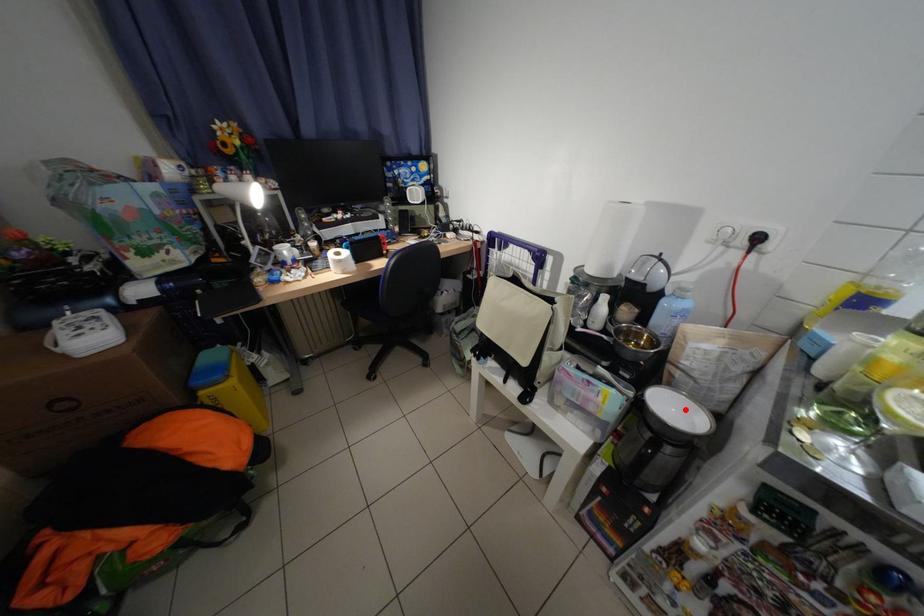
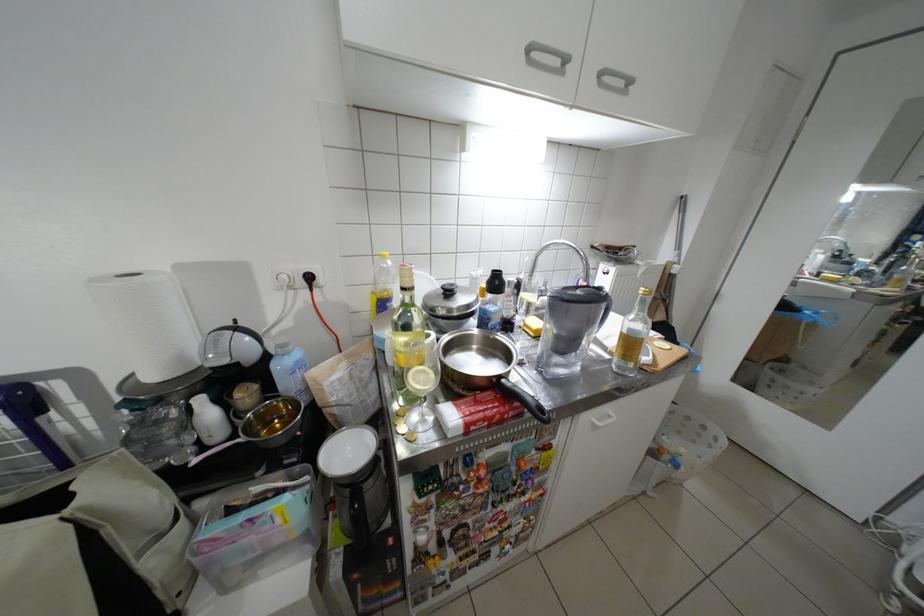
Question: A red point is marked in image1. In image2, is the corresponding 3D point closer to the camera or farther? Reply with the corresponding letter.

Choices:
 (A) The corresponding 3D point is closer.
 (B) The corresponding 3D point is farther.

Answer: (A)